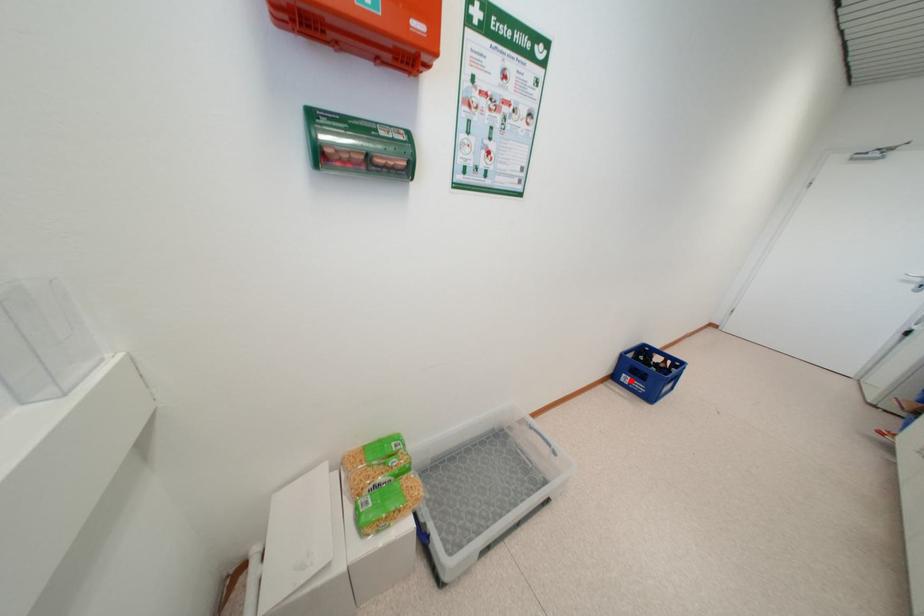
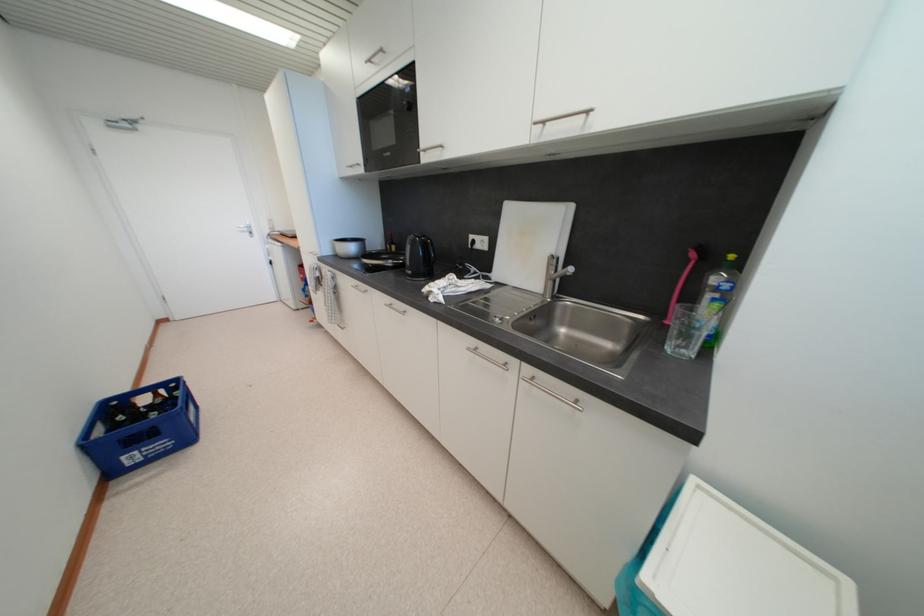
Question: I am providing you with two images of the same scene from different viewpoints. Image1 has a red point marked. In image2, the corresponding 3D location appears at what relative position? Reply with the corresponding letter.

Choices:
 (A) Closer
 (B) Farther

Answer: (A)